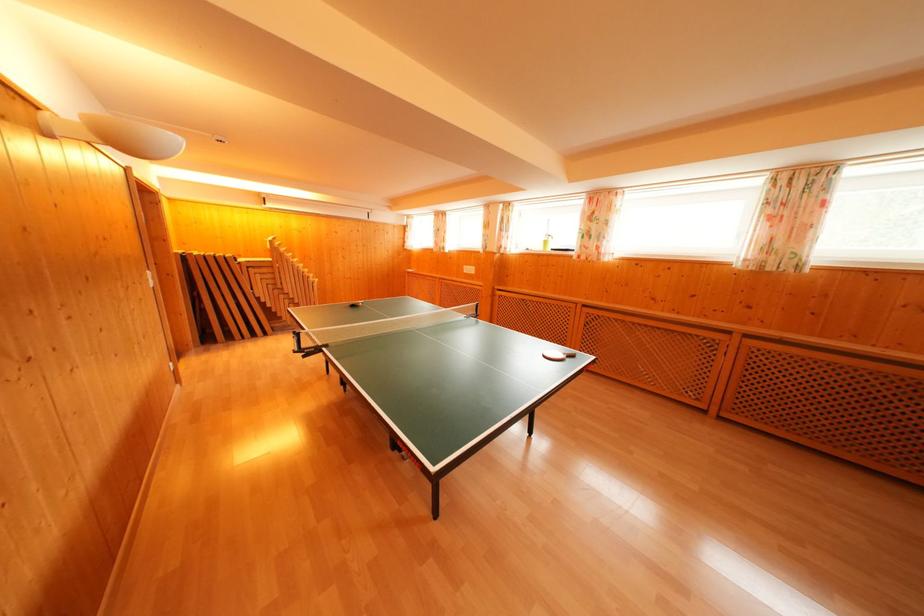
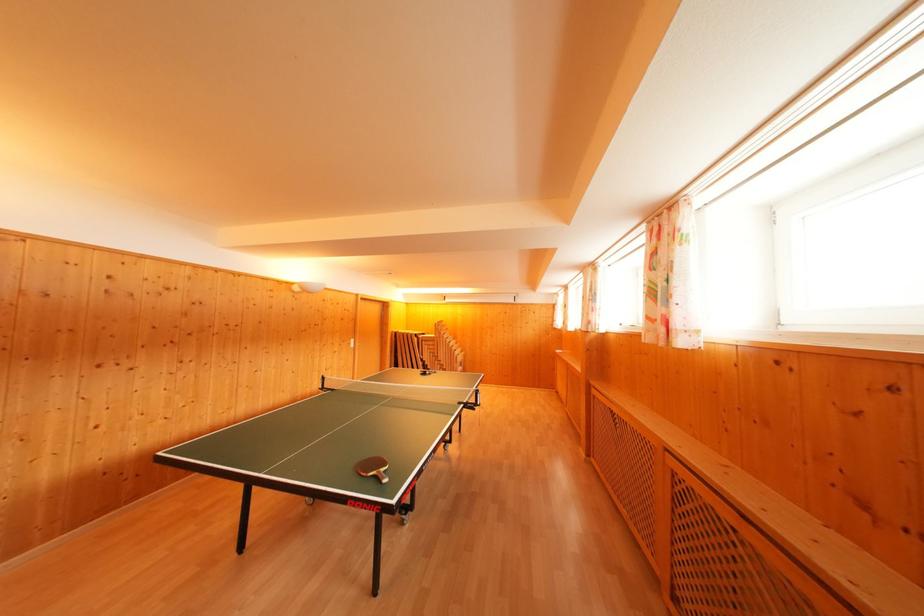
Locate, in the second image, the point that corresponds to [293,294] in the first image.

(445, 362)